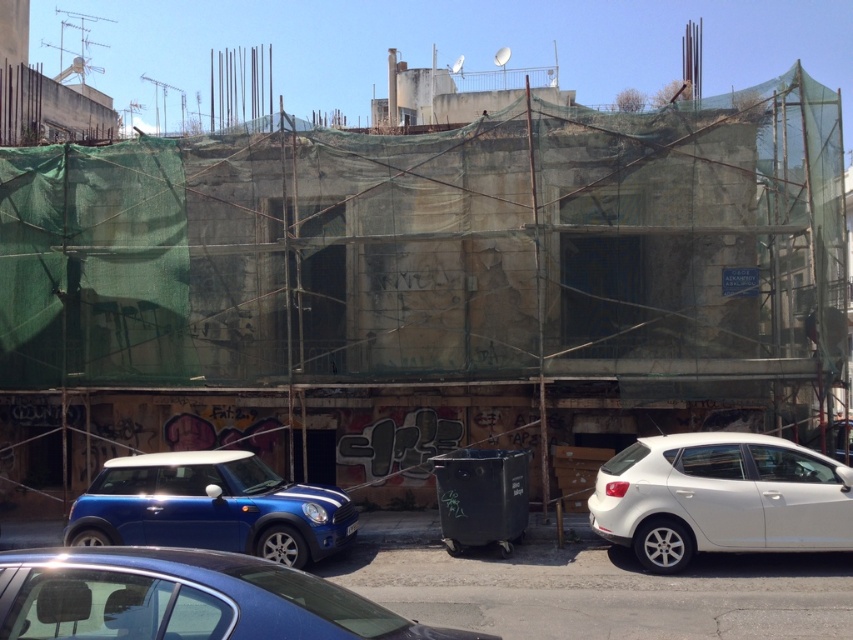
Question: Is white matte hatchback at right positioned at the back of shiny blue car at lower left?

Choices:
 (A) yes
 (B) no

Answer: (B)

Question: Which object is farther from the camera taking this photo?

Choices:
 (A) shiny blue sedan at lower center
 (B) white matte hatchback at right

Answer: (B)

Question: Is shiny blue sedan at lower center thinner than shiny blue car at lower left?

Choices:
 (A) no
 (B) yes

Answer: (B)

Question: Does white matte hatchback at right have a smaller size compared to shiny blue car at lower left?

Choices:
 (A) no
 (B) yes

Answer: (B)

Question: Which point appears closest to the camera in this image?

Choices:
 (A) (648, 451)
 (B) (114, 625)

Answer: (B)

Question: Which object appears farthest from the camera in this image?

Choices:
 (A) shiny blue sedan at lower center
 (B) shiny blue car at lower left

Answer: (B)